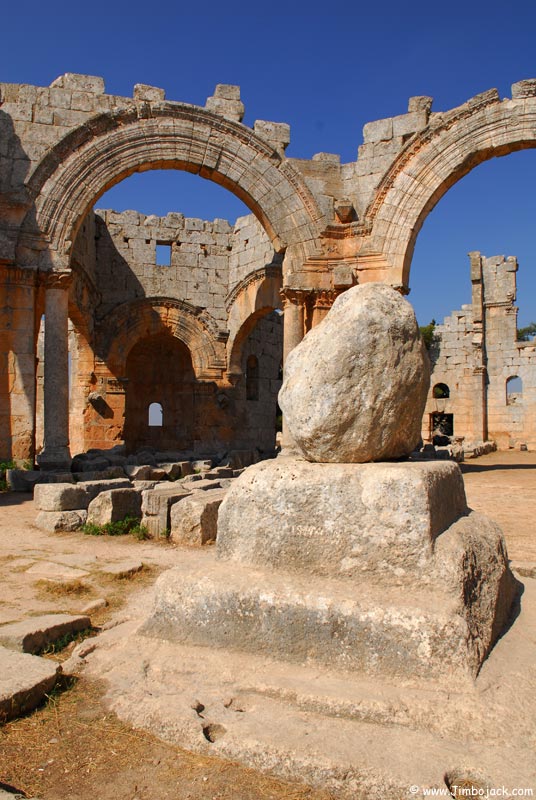
Image resolution: width=536 pixels, height=800 pixels. I want to click on shadow on wall, so click(121, 313).